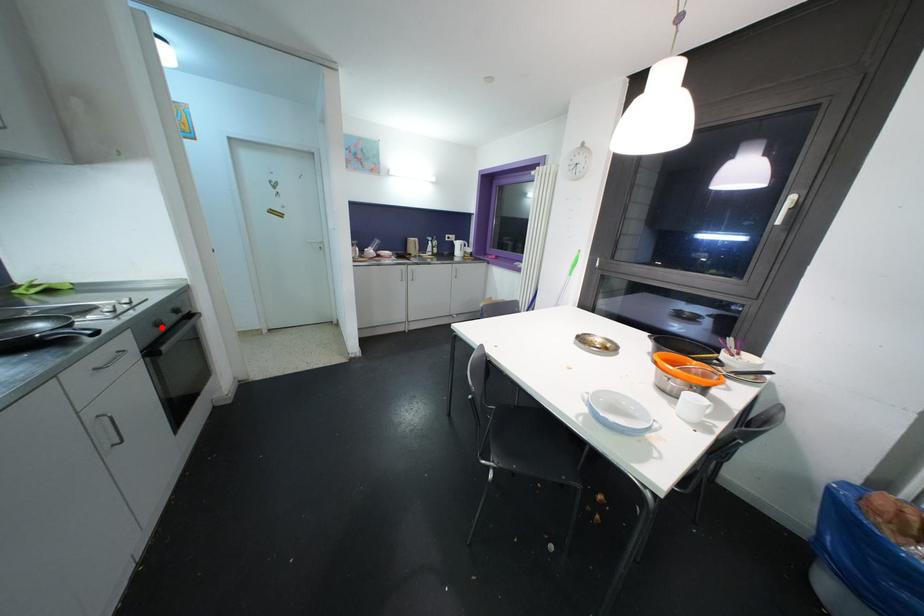
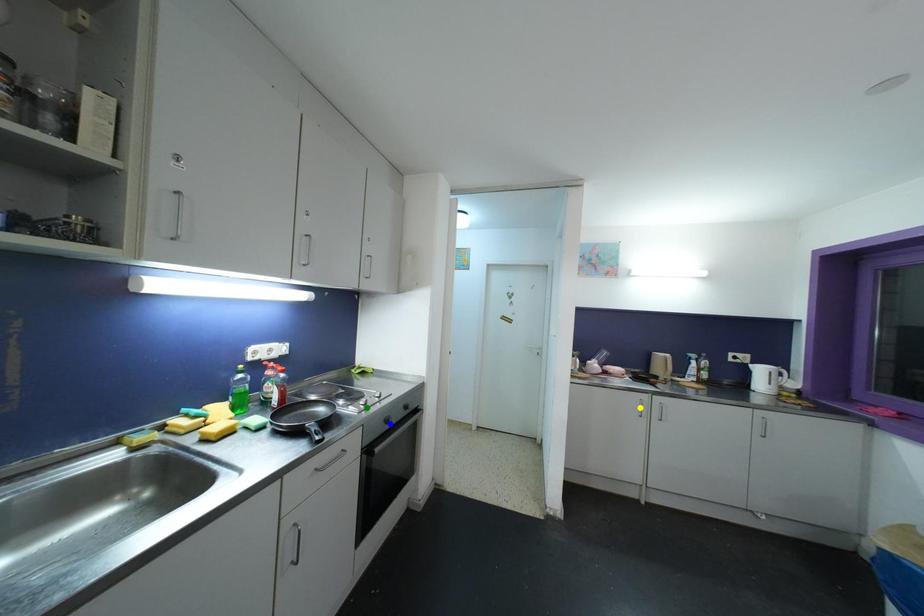
Question: I am providing you with two images of the same scene from different viewpoints. A red point is marked on the first image. You are given multiple points on the second image. Which point in image 2 represents the same 3d spot as the red point in image 1?

Choices:
 (A) blue point
 (B) yellow point
 (C) green point

Answer: (A)